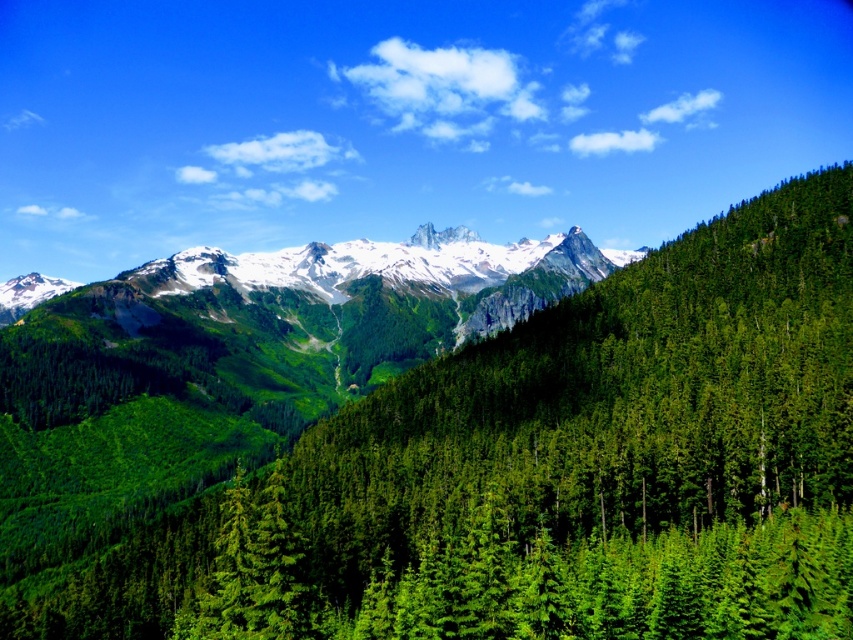
Can you confirm if green forested mountain at center is shorter than white snow-covered mountain range at center?

Incorrect, green forested mountain at center's height does not fall short of white snow-covered mountain range at center's.

Does green forested mountain at center come in front of white snow-covered mountain range at center?

That is True.

You are a GUI agent. You are given a task and a screenshot of the screen. Output one action in this format:
    pyautogui.click(x=<x>, y=<y>)
    Task: Click on the green forested mountain at center
    This screenshot has height=640, width=853.
    Given the screenshot: What is the action you would take?
    pyautogui.click(x=439, y=444)